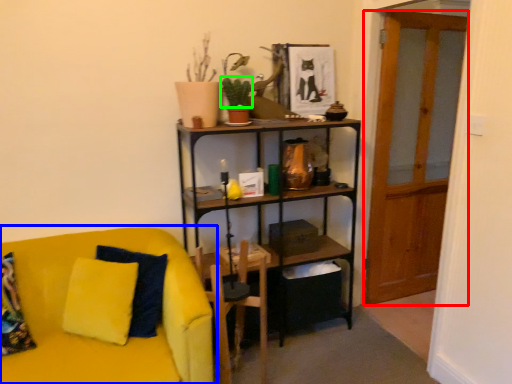
Question: Considering the real-world distances, which object is farthest from glass door (highlighted by a red box)? studio couch (highlighted by a blue box) or plant (highlighted by a green box)?

Choices:
 (A) studio couch
 (B) plant

Answer: (A)